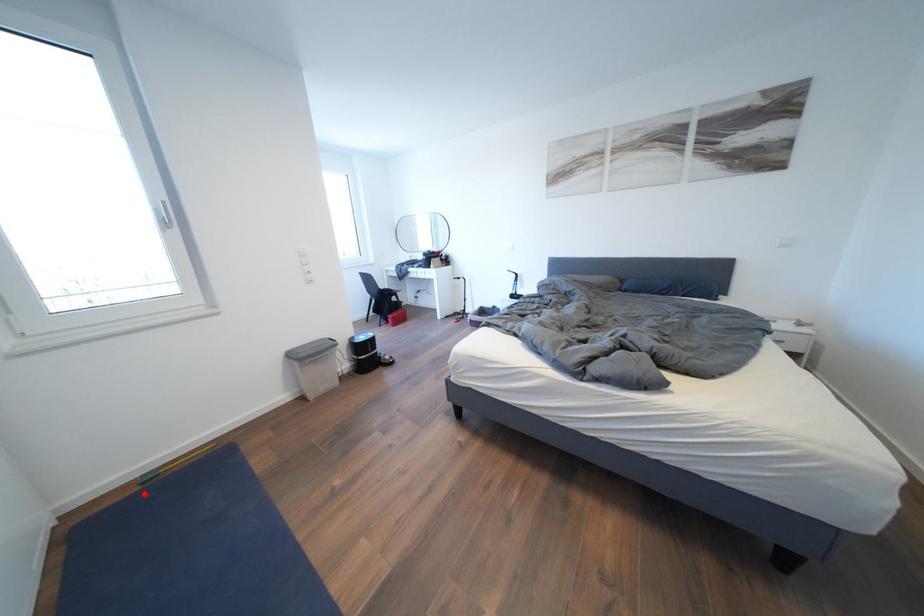
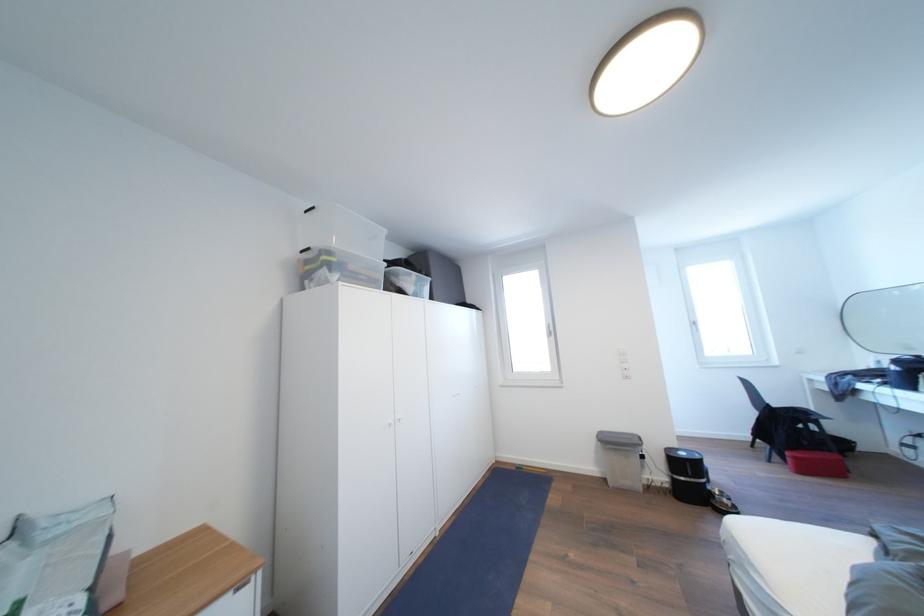
Find the pixel in the second image that matches the highlighted location in the first image.

(521, 472)